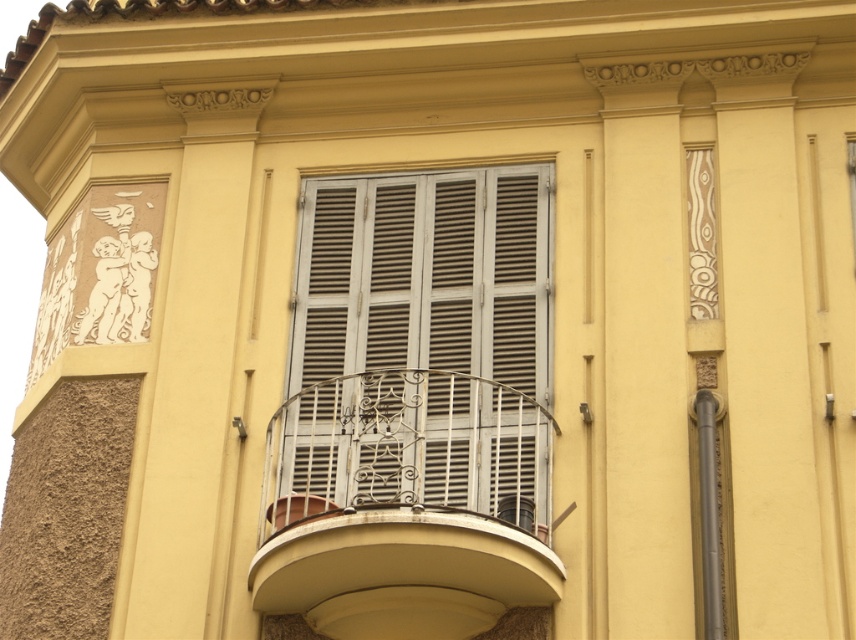
Between white matte shutters at center and white metal balcony at center, which one appears on the left side from the viewer's perspective?

From the viewer's perspective, white metal balcony at center appears more on the left side.

Is point (494, 236) positioned in front of point (468, 381)?

No, (494, 236) is behind (468, 381).

Is point (378, 404) farther from viewer compared to point (423, 531)?

Yes, it is.

Find the location of a particular element. white matte shutters at center is located at coordinates (420, 340).